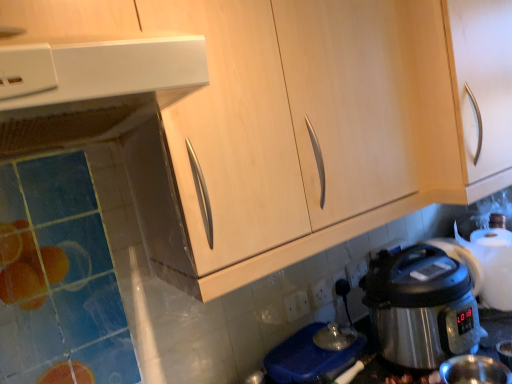
Question: Considering the relative positions of white plastic electric outlet at lower center, positioned as the first electric outlet in left-to-right order, and black plastic electric outlet at lower center, the first electric outlet when ordered from right to left, in the image provided, is white plastic electric outlet at lower center, positioned as the first electric outlet in left-to-right order, to the right of black plastic electric outlet at lower center, the first electric outlet when ordered from right to left, from the viewer's perspective?

Choices:
 (A) no
 (B) yes

Answer: (A)

Question: Does white plastic electric outlet at lower center, arranged as the 2th electric outlet when viewed from the right, have a greater width compared to black plastic electric outlet at lower center, the first electric outlet when ordered from right to left?

Choices:
 (A) yes
 (B) no

Answer: (A)

Question: Is white plastic electric outlet at lower center, positioned as the first electric outlet in left-to-right order, directly adjacent to black plastic electric outlet at lower center, the first electric outlet when ordered from right to left?

Choices:
 (A) yes
 (B) no

Answer: (A)

Question: Could you tell me if white plastic electric outlet at lower center, arranged as the 2th electric outlet when viewed from the right, is facing black plastic electric outlet at lower center, the second electric outlet when ordered from left to right?

Choices:
 (A) no
 (B) yes

Answer: (A)

Question: Are white plastic electric outlet at lower center, arranged as the 2th electric outlet when viewed from the right, and black plastic electric outlet at lower center, the first electric outlet when ordered from right to left, far apart?

Choices:
 (A) no
 (B) yes

Answer: (A)

Question: From the image's perspective, is white plastic electric outlet at lower center, arranged as the 2th electric outlet when viewed from the right, on black plastic electric outlet at lower center, the second electric outlet when ordered from left to right?

Choices:
 (A) no
 (B) yes

Answer: (A)

Question: Is black plastic electric outlet at lower center, the first electric outlet when ordered from right to left, not inside white plastic power plugs and sockets at lower center?

Choices:
 (A) yes
 (B) no

Answer: (A)

Question: Does black plastic electric outlet at lower center, the first electric outlet when ordered from right to left, touch white plastic power plugs and sockets at lower center?

Choices:
 (A) no
 (B) yes

Answer: (B)

Question: Is the position of black plastic electric outlet at lower center, the second electric outlet when ordered from left to right, more distant than that of white plastic power plugs and sockets at lower center?

Choices:
 (A) no
 (B) yes

Answer: (A)

Question: Can you confirm if black plastic electric outlet at lower center, the first electric outlet when ordered from right to left, is smaller than white plastic power plugs and sockets at lower center?

Choices:
 (A) no
 (B) yes

Answer: (B)

Question: Can you confirm if black plastic electric outlet at lower center, the second electric outlet when ordered from left to right, is taller than white plastic power plugs and sockets at lower center?

Choices:
 (A) no
 (B) yes

Answer: (A)

Question: Is black plastic electric outlet at lower center, the first electric outlet when ordered from right to left, positioned far away from white plastic power plugs and sockets at lower center?

Choices:
 (A) no
 (B) yes

Answer: (A)

Question: From the image's perspective, is shiny metallic coffee cup at lower right below light wood cabinet at upper right?

Choices:
 (A) yes
 (B) no

Answer: (A)